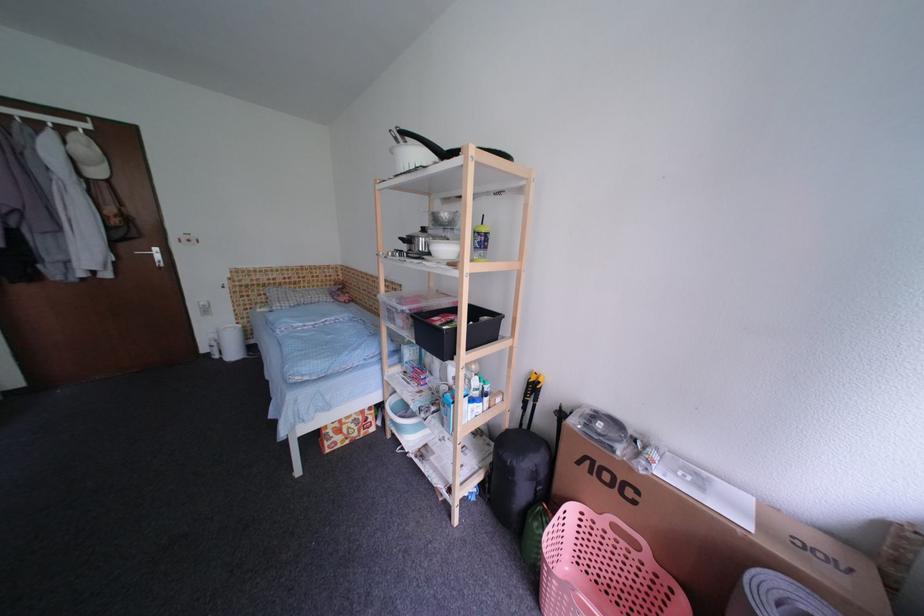
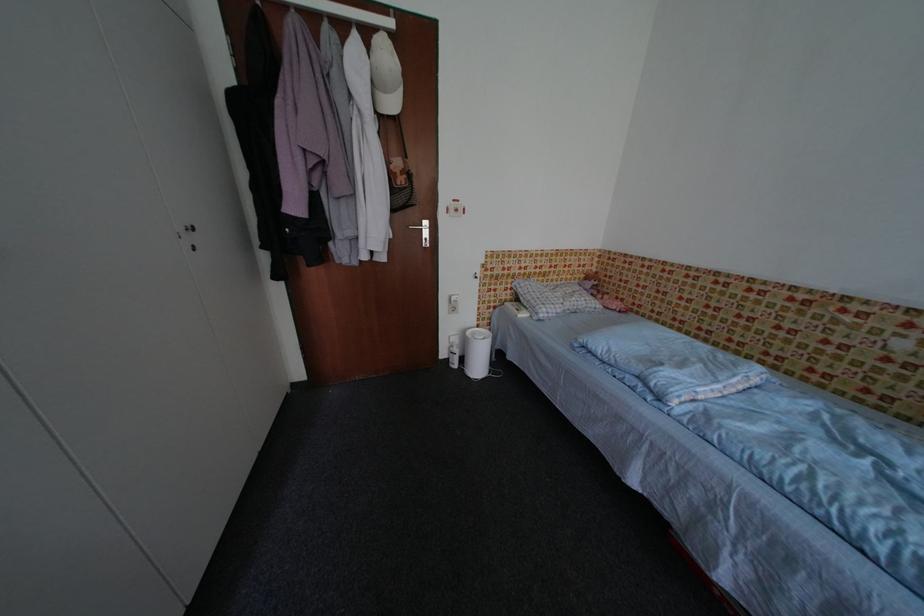
Where in the second image is the point corresponding to (x=222, y=338) from the first image?

(464, 342)